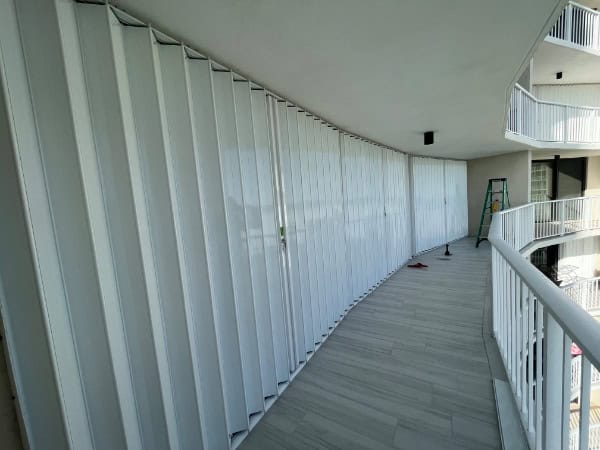
This screenshot has width=600, height=450. In order to click on ladder in this screenshot , I will do (x=504, y=193).